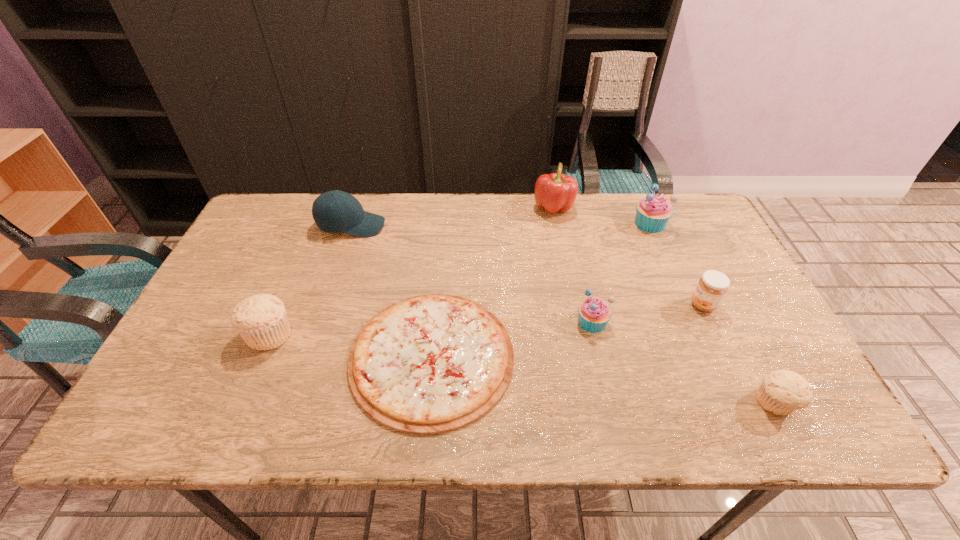
Identify the location of vacant point located on the back of the nearer beige muffin. (703, 265).

This screenshot has height=540, width=960. What are the coordinates of `vacant space located on the left of the pizza` in the screenshot? It's located at click(303, 356).

The image size is (960, 540). Identify the location of pepper situated at the far edge. (556, 192).

This screenshot has width=960, height=540. I want to click on baseball cap that is at the far edge, so click(x=335, y=211).

Find the location of a particular element. This screenshot has height=540, width=960. muffin that is at the far edge is located at coordinates (652, 213).

Where is `muffin that is at the near edge`? muffin that is at the near edge is located at coordinates (781, 392).

I want to click on pizza present at the near edge, so click(x=429, y=364).

Locate an element on the screen. object located at the left edge is located at coordinates (261, 320).

The image size is (960, 540). I want to click on jam located in the right edge section of the desktop, so click(x=712, y=286).

Identify the location of object positioned at the far right corner. (652, 213).